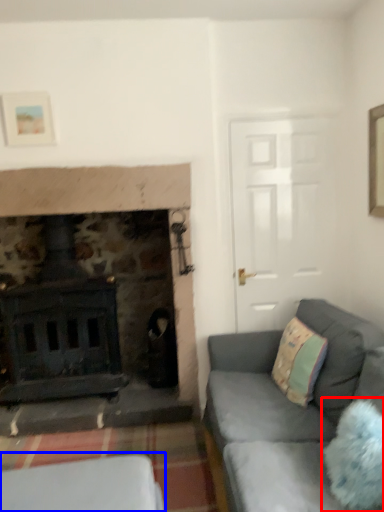
Question: Which point is further to the camera, pillow (highlighted by a red box) or furniture (highlighted by a blue box)?

Choices:
 (A) pillow
 (B) furniture

Answer: (B)